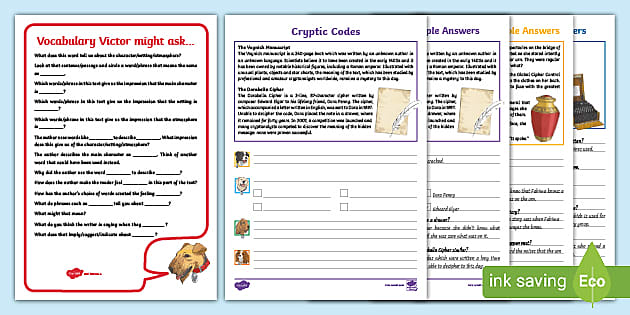
The image size is (630, 315). Identify the location of urn. (547, 126).